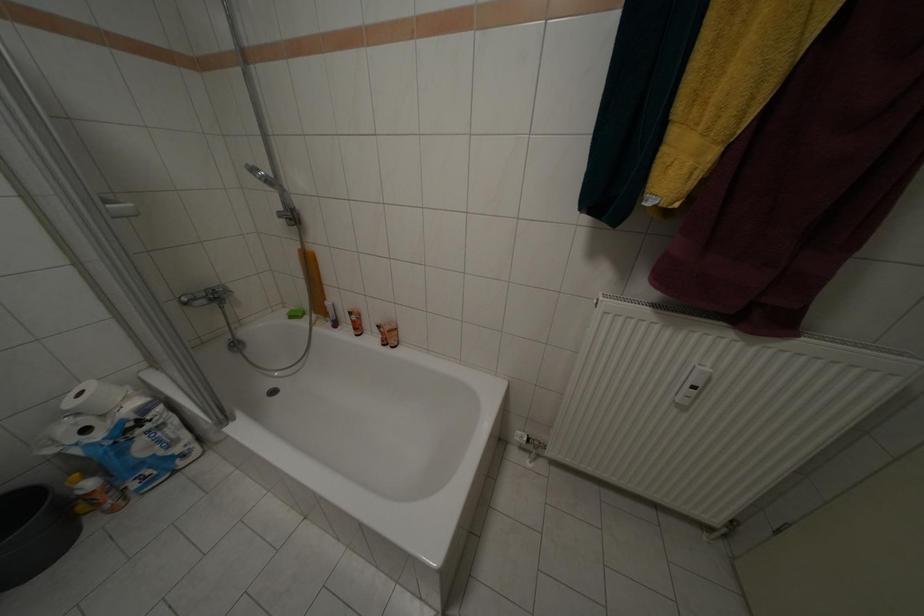
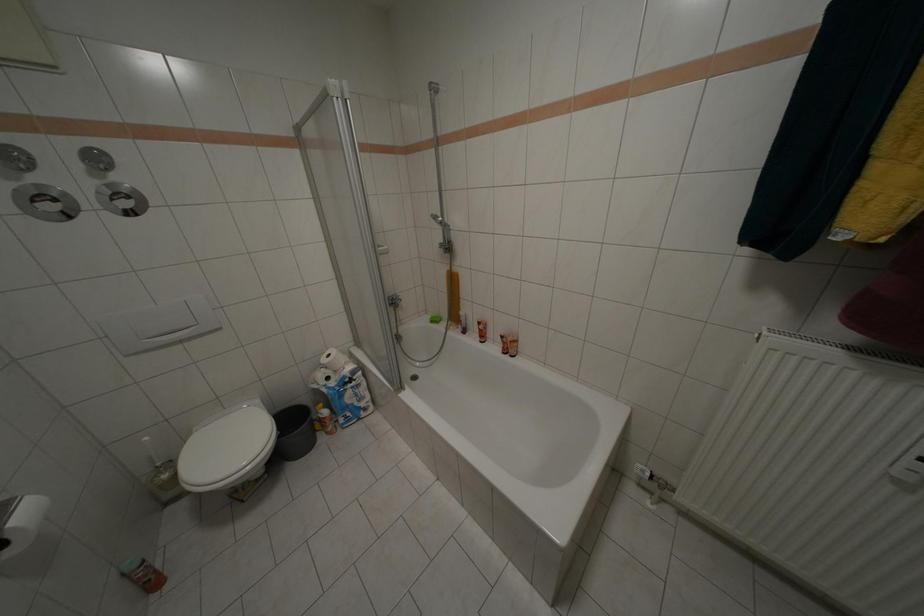
Looking at this image, the images are taken continuously from a first-person perspective. In which direction are you moving?

The cameraman moved toward left, backward.